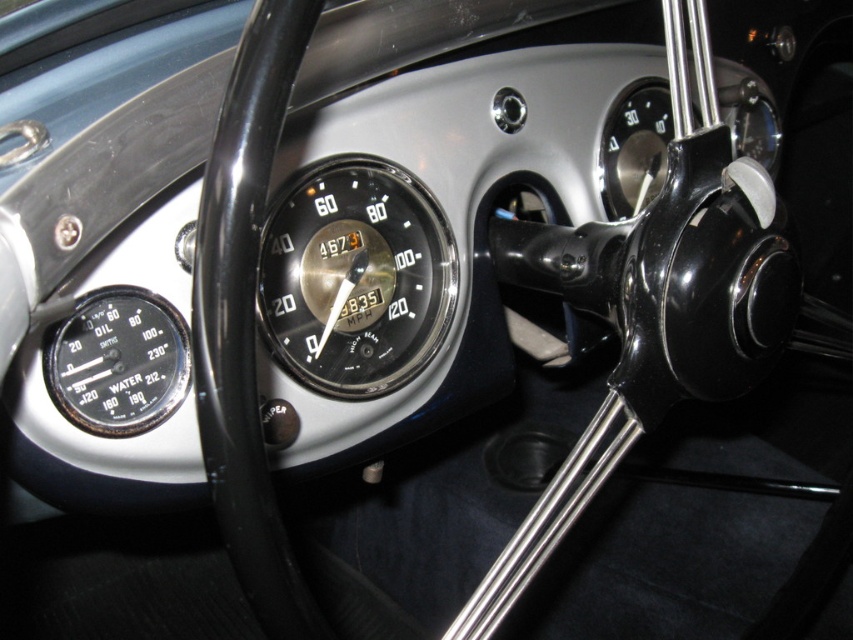
Consider the image. Which is below, shiny chrome speedometer at center or black metallic gauge at left?

black metallic gauge at left is below.

Does point (300, 188) come behind point (96, 426)?

Yes, point (300, 188) is farther from viewer.

Is point (376, 172) farther from viewer compared to point (125, 401)?

Yes, it is.

At what (x,y) coordinates should I click in order to perform the action: click on shiny chrome speedometer at center. Please return your answer as a coordinate pair (x, y). The height and width of the screenshot is (640, 853). Looking at the image, I should click on click(355, 276).